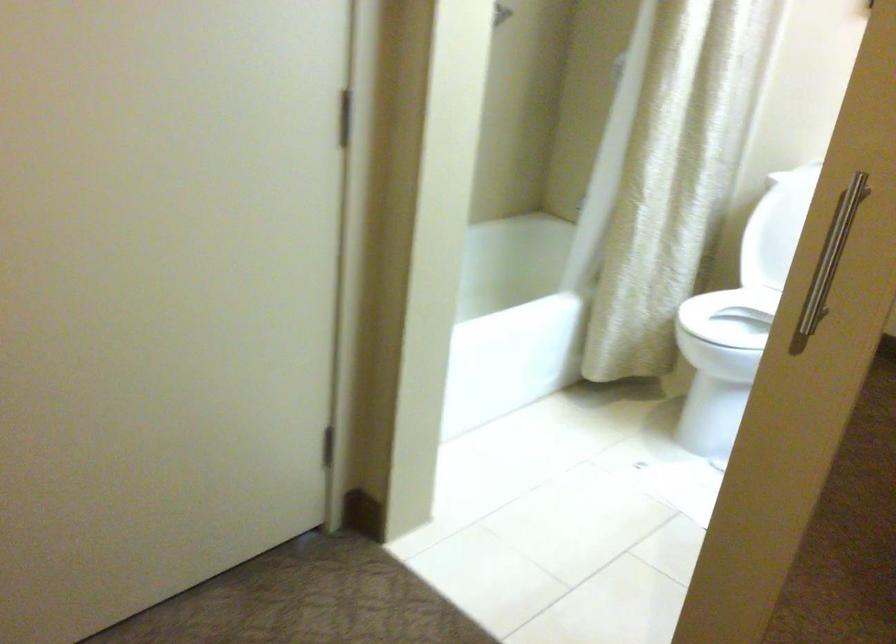
The width and height of the screenshot is (896, 644). In order to click on metal door handle in this screenshot , I will do `click(831, 254)`.